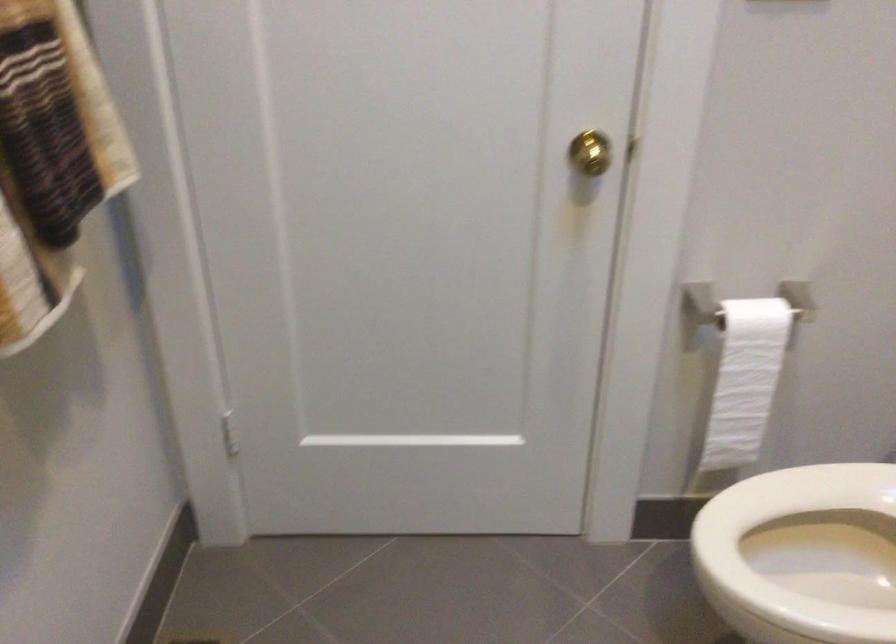
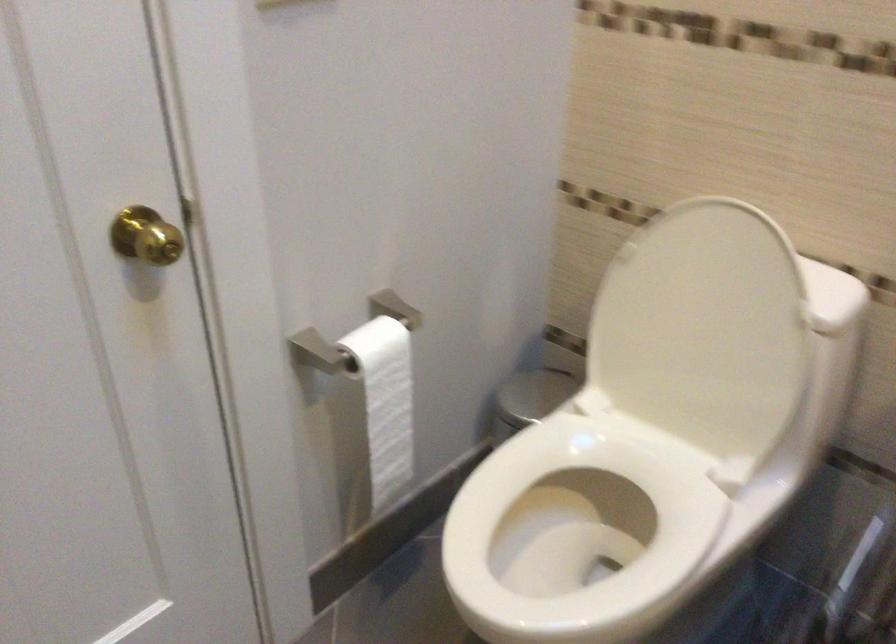
In the second image, find the point that corresponds to (x=741, y=372) in the first image.

(385, 402)